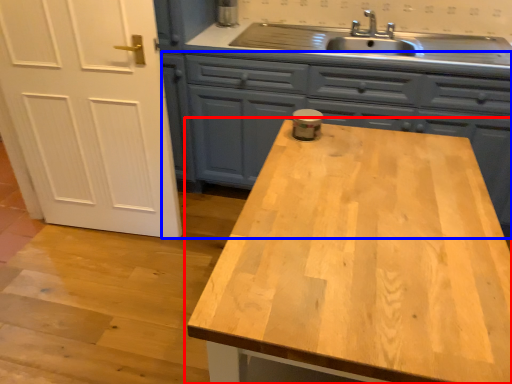
Question: Which point is further to the camera, countertop (highlighted by a red box) or cabinetry (highlighted by a blue box)?

Choices:
 (A) countertop
 (B) cabinetry

Answer: (B)